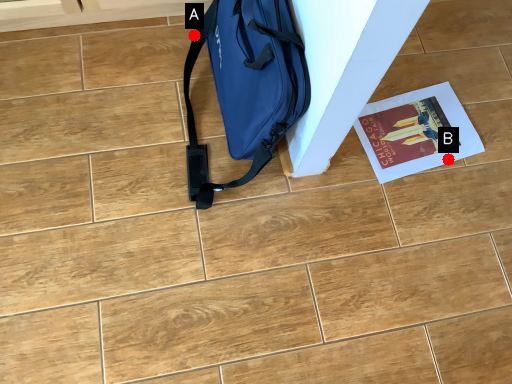
Question: Two points are circled on the image, labeled by A and B beside each circle. Among these points, which one is farthest from the camera?

Choices:
 (A) A is further
 (B) B is further

Answer: (A)